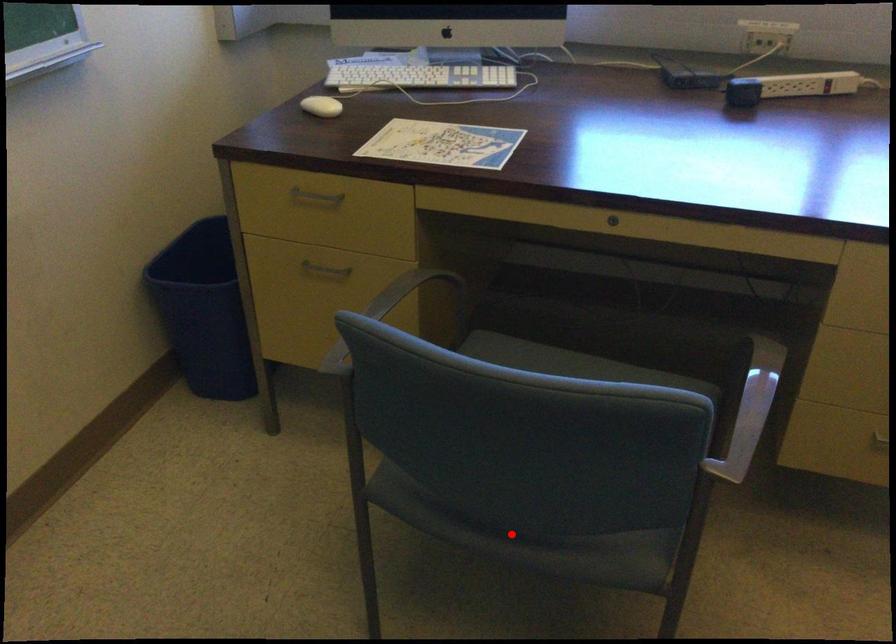
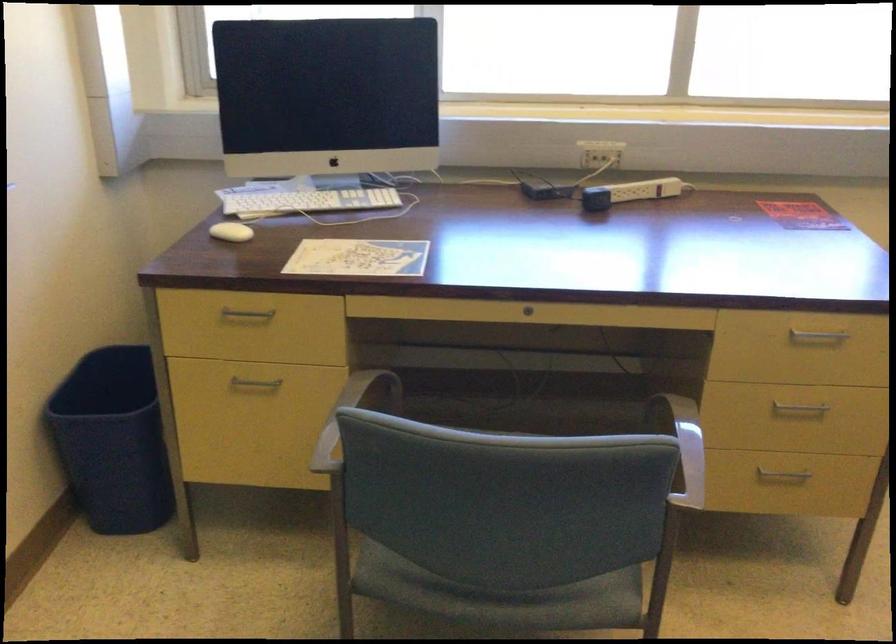
Question: I am providing you with two images of the same scene from different viewpoints. A red point is marked on the first image. Can you still see the location of the red point in image 2?

Choices:
 (A) Yes
 (B) No

Answer: (A)